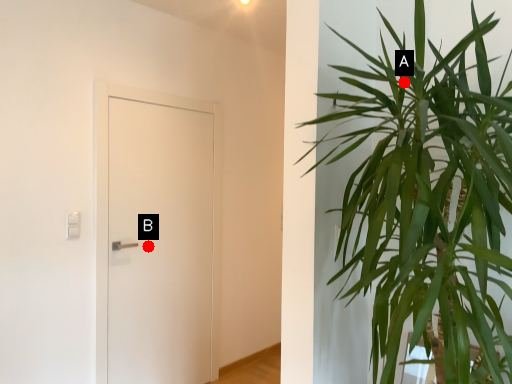
Question: Two points are circled on the image, labeled by A and B beside each circle. Which point is further to the camera?

Choices:
 (A) A is further
 (B) B is further

Answer: (B)